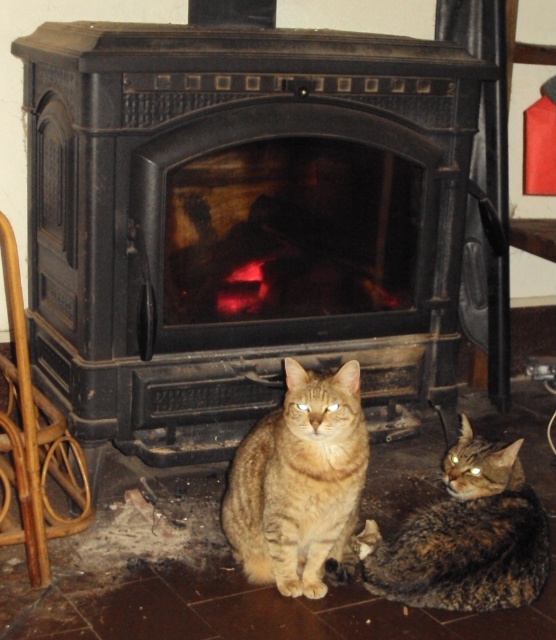
You are a photographer trying to capture both the black matte fireplace at center and the tabby fur cat at center in a single frame. Based on their positions, which object should you focus on first to ensure both are in the frame?

The black matte fireplace at center is positioned on the left side of the tabby fur cat at center. To ensure both are in the frame, focus on the tabby fur cat at center first since it is closer to the center, allowing the fireplace to be captured on its left side.